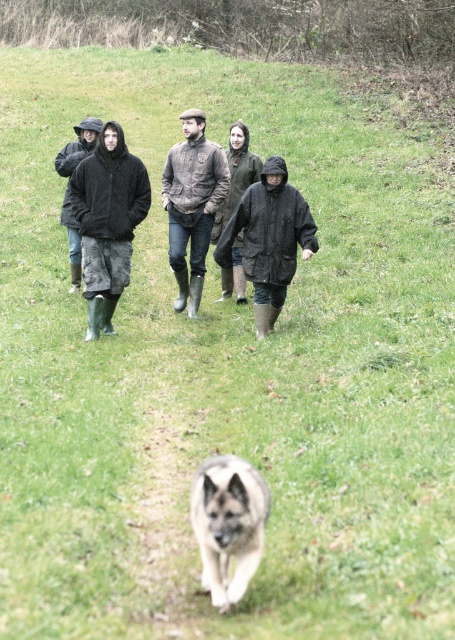
You are a hiker who wants to retrieve your matte black jacket at center. You are currently at point (107, 221). Is the matte black jacket at center located at your current position?

Yes, the matte black jacket at center is located exactly at point (107, 221), so you are already at the correct position to retrieve it.

You are a photographer trying to capture a clear shot of both the matte black jacket at center and the dark matte jacket at center. Since they are both at the center, which one will appear larger in the photo?

The matte black jacket at center will appear larger in the photo because it has a larger size compared to the dark matte jacket at center.